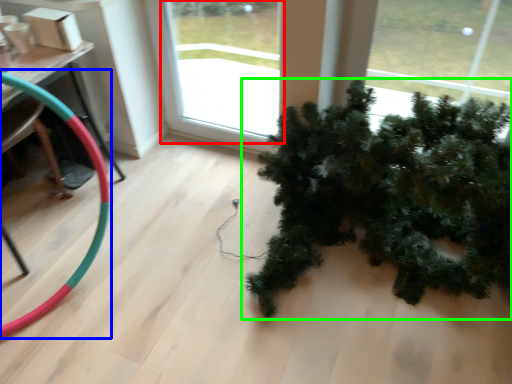
Question: Based on their relative distances, which object is farther from window (highlighted by a red box)? Choose from garden hose (highlighted by a blue box) and houseplant (highlighted by a green box).

Choices:
 (A) garden hose
 (B) houseplant

Answer: (A)